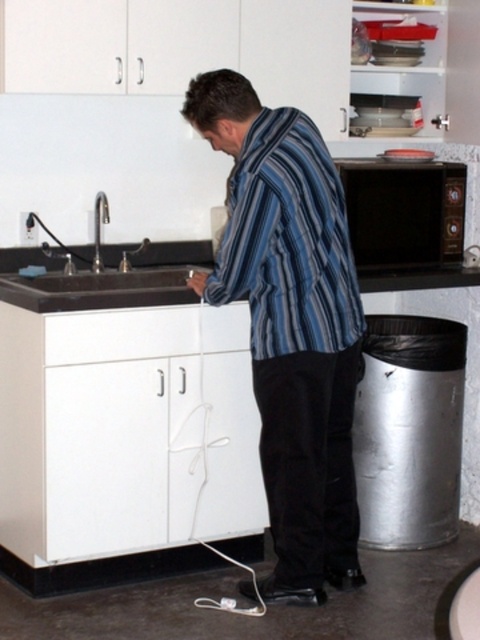
You are a home inspector examining the kitchen. You notice the man in the blue striped shirt at center and the striped cotton shirt at center. Which shirt is closer to you?

The blue striped shirt at center is closer to you because the striped cotton shirt at center is behind it.

You are a repair technician in a kitchen and see a point marked at coordinates (289,324). According to the scene description, where is this point located?

The point is on the blue striped shirt at center.